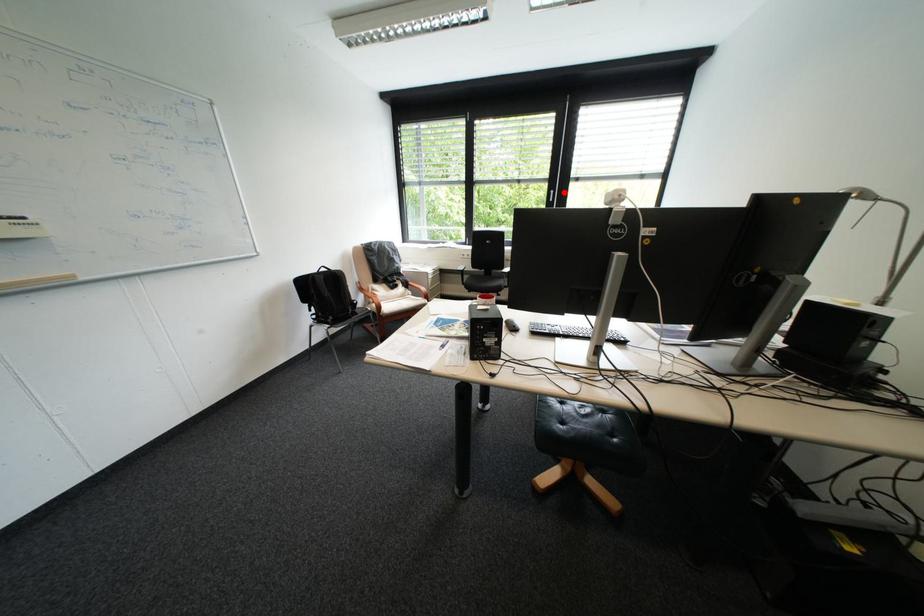
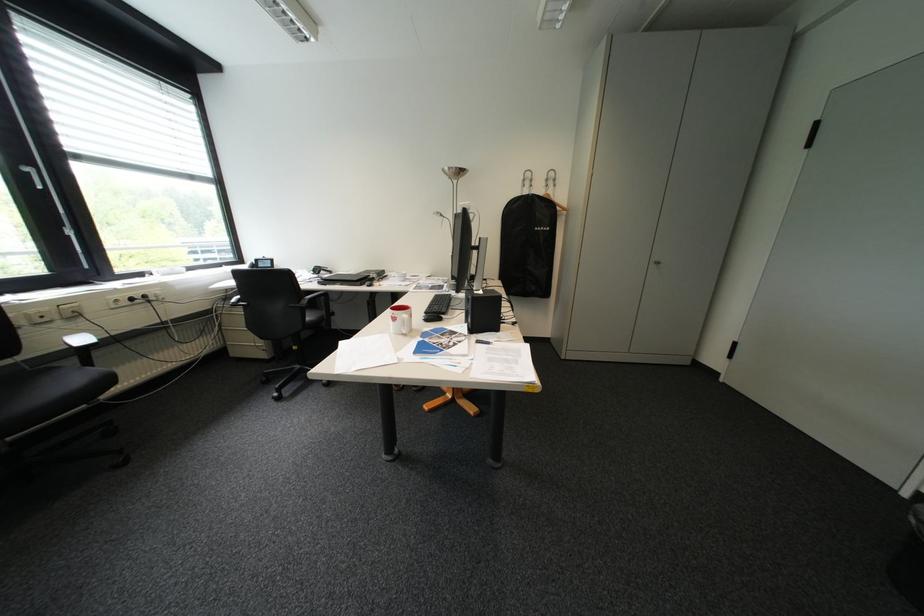
Find the pixel in the second image that matches the highlighted location in the first image.

(41, 169)